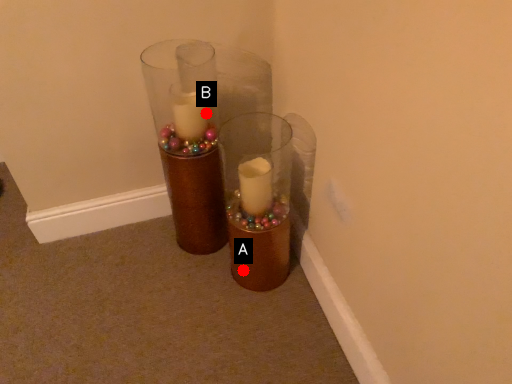
Question: Two points are circled on the image, labeled by A and B beside each circle. Which point is further to the camera?

Choices:
 (A) A is further
 (B) B is further

Answer: (A)